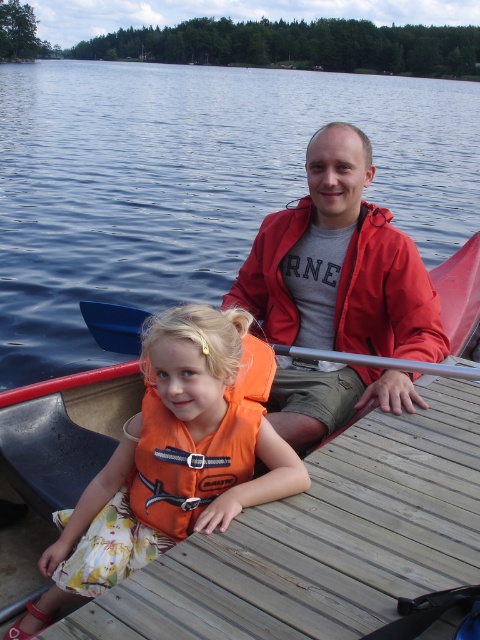
Is orange fabric life jacket at center to the right of smooth plastic paddle at center from the viewer's perspective?

Incorrect, orange fabric life jacket at center is not on the right side of smooth plastic paddle at center.

Between point (153, 516) and point (97, 339), which one is positioned behind?

Positioned behind is point (97, 339).

At what (x,y) coordinates should I click in order to perform the action: click on orange fabric life jacket at center. Please return your answer as a coordinate pair (x, y). The width and height of the screenshot is (480, 640). Looking at the image, I should click on (197, 449).

Between blue water at center and orange fabric life jacket at center, which one is positioned higher?

Positioned higher is blue water at center.

Does blue water at center appear over orange fabric life jacket at center?

Yes, blue water at center is above orange fabric life jacket at center.

I want to click on blue water at center, so click(192, 182).

At what (x,y) coordinates should I click in order to perform the action: click on blue water at center. Please return your answer as a coordinate pair (x, y). The image size is (480, 640). Looking at the image, I should click on (192, 182).

Is blue water at center thinner than smooth plastic paddle at center?

In fact, blue water at center might be wider than smooth plastic paddle at center.

Locate an element on the screen. blue water at center is located at coordinates (192, 182).

The image size is (480, 640). What do you see at coordinates (192, 182) in the screenshot? I see `blue water at center` at bounding box center [192, 182].

Locate an element on the screen. Image resolution: width=480 pixels, height=640 pixels. blue water at center is located at coordinates (192, 182).